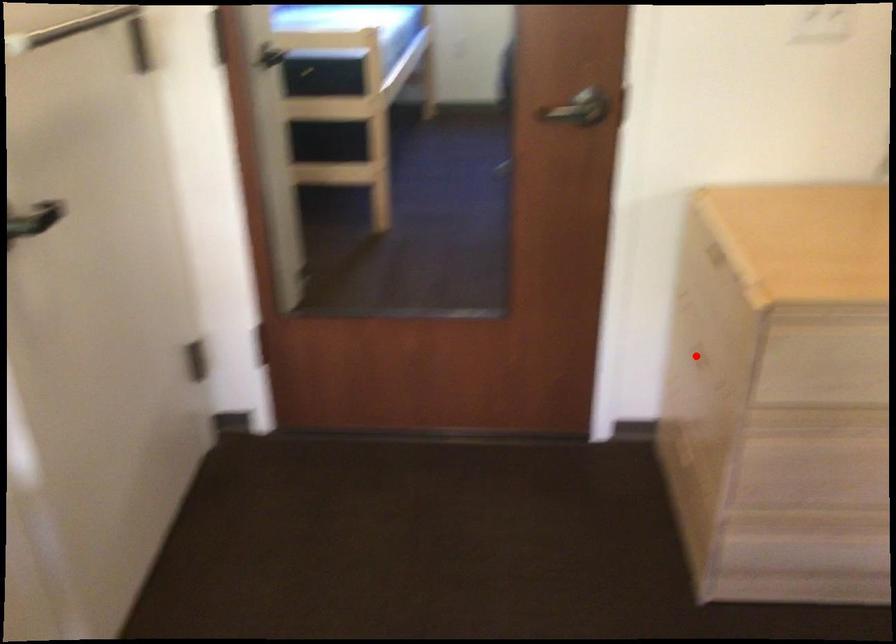
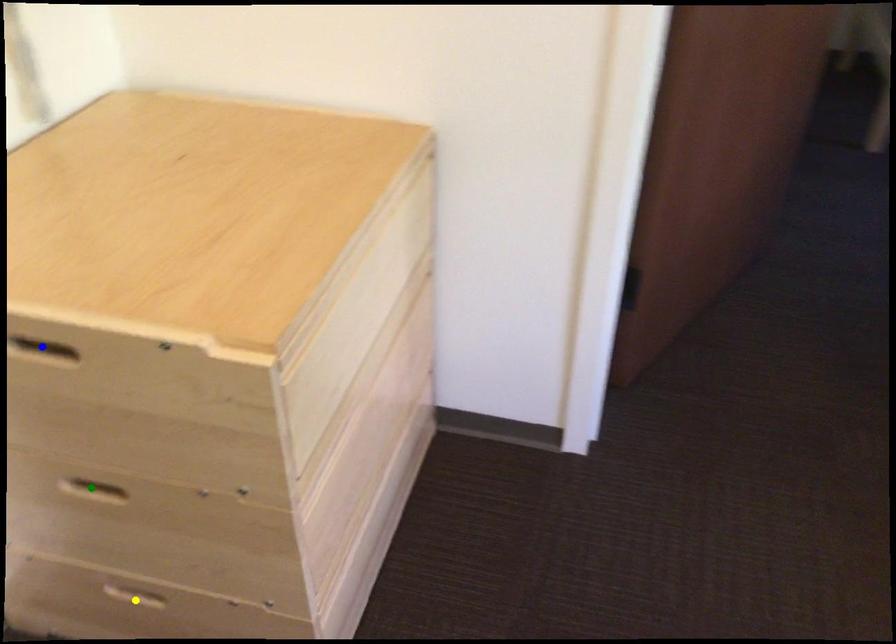
Question: I am providing you with two images of the same scene from different viewpoints. A red point is marked on the first image. You are given multiple points on the second image. Which mark in image 2 goes with the point in image 1?

Choices:
 (A) blue point
 (B) yellow point
 (C) green point

Answer: (C)